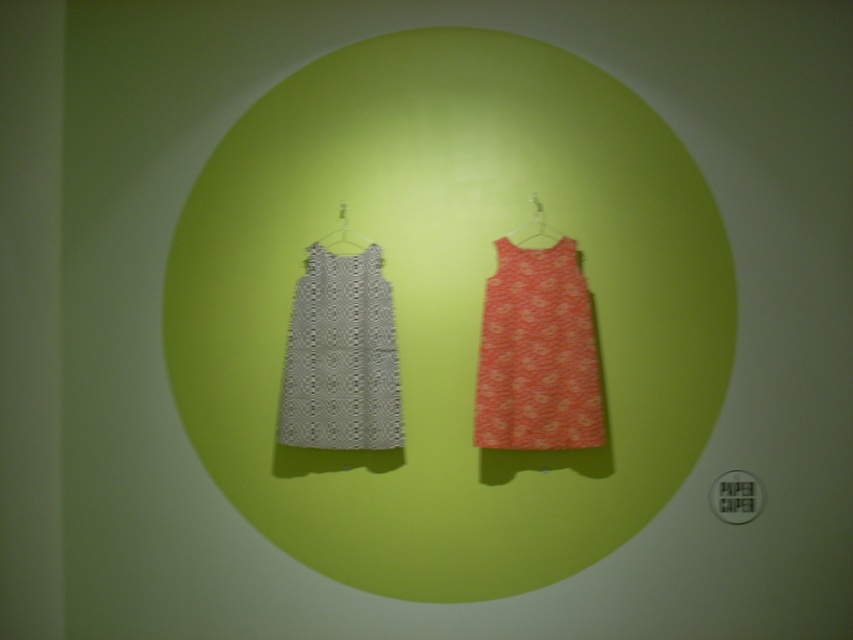
Question: Does gray textured dress at center have a lesser width compared to metallic silver hanger at upper center?

Choices:
 (A) yes
 (B) no

Answer: (B)

Question: Among these objects, which one is nearest to the camera?

Choices:
 (A) white plastic hanger at center
 (B) metallic silver hanger at upper center
 (C) matte orange dress at center

Answer: (C)

Question: Considering the relative positions of matte orange dress at center and white plastic hanger at center in the image provided, where is matte orange dress at center located with respect to white plastic hanger at center?

Choices:
 (A) right
 (B) left

Answer: (A)

Question: Estimate the real-world distances between objects in this image. Which object is closer to the white plastic hanger at center?

Choices:
 (A) matte orange dress at center
 (B) metallic silver hanger at upper center

Answer: (B)

Question: Which object is the closest to the matte orange dress at center?

Choices:
 (A) gray textured dress at center
 (B) white plastic hanger at center

Answer: (A)

Question: Is matte orange dress at center behind white plastic hanger at center?

Choices:
 (A) no
 (B) yes

Answer: (A)